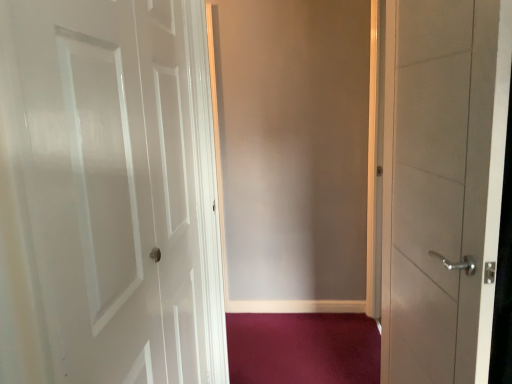
Identify the location of vacant point above purple carpet at lower center (from a real-world perspective). (292, 345).